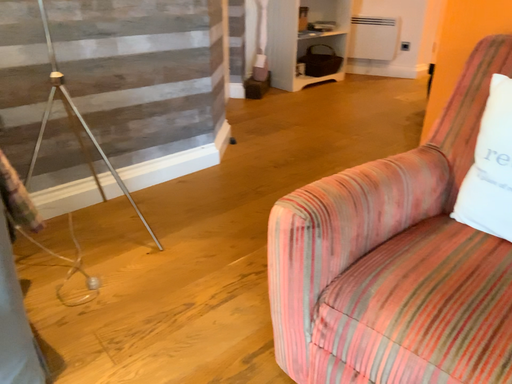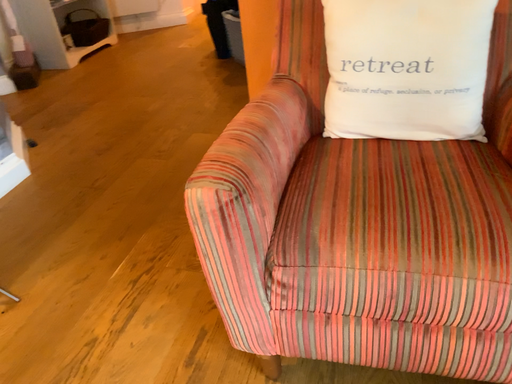
Question: Which way did the camera rotate in the video?

Choices:
 (A) rotated right
 (B) rotated left

Answer: (A)